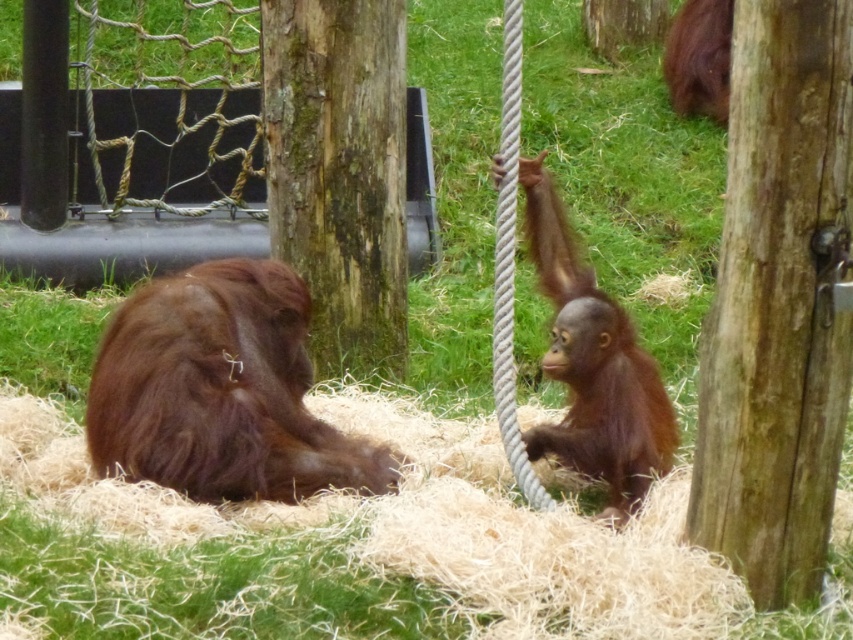
You are a zookeeper observing the two orangutans. You need to place a banana between them so that it is closer to the brown rough tree trunk at upper center than to the brown furry orangutan at left. Where should you place the banana?

The banana should be placed closer to the brown rough tree trunk at upper center than to the brown furry orangutan at left, ensuring it is between them but nearer to the tree trunk.

You are a zookeeper who needs to place a new feeding tray between the wooden post at center and the green mossy wood at center. The tray requires at least 10 feet of space to be placed safely. Based on the scene, can you fit the feeding tray between them?

The wooden post at center and green mossy wood at center are 9.39 feet apart, which is less than the required 10 feet. Therefore, the feeding tray cannot be placed safely between them.